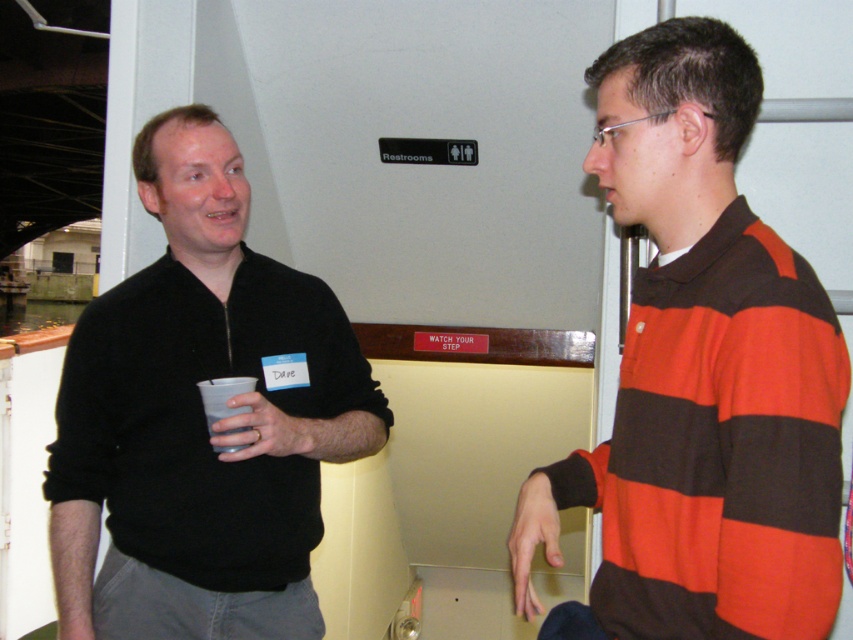
You are standing in the conference room and see two points marked in the image. The first point is at coordinates point[619,150] and the second point is at point[146,502]. Which point is closer to you?

Point[619,150] is closer to the viewer than point[146,502].

You are a fashion designer observing two people in an event space. You notice the striped cotton shirt at right and the black matte sweater at center. Which clothing item is shorter in length?

The striped cotton shirt at right is shorter than the black matte sweater at center.

You are organizing a charity event and need to arrange two donated items for a silent auction. The striped cotton shirt at right and the black matte sweater at center are both on display. Based on their sizes, which item would you place on a smaller shelf to save space?

The striped cotton shirt at right has a smaller size compared to the black matte sweater at center, so it should be placed on a smaller shelf to save space.